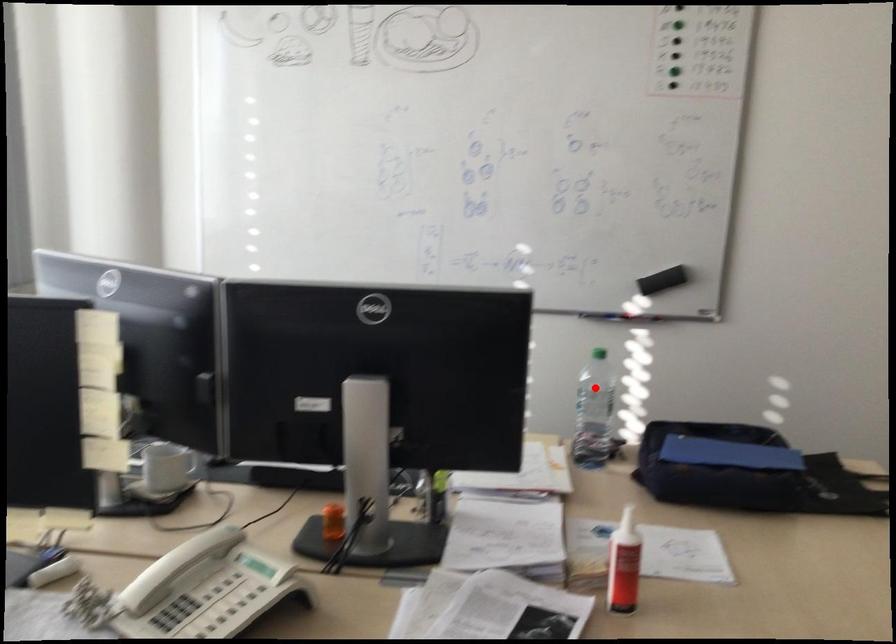
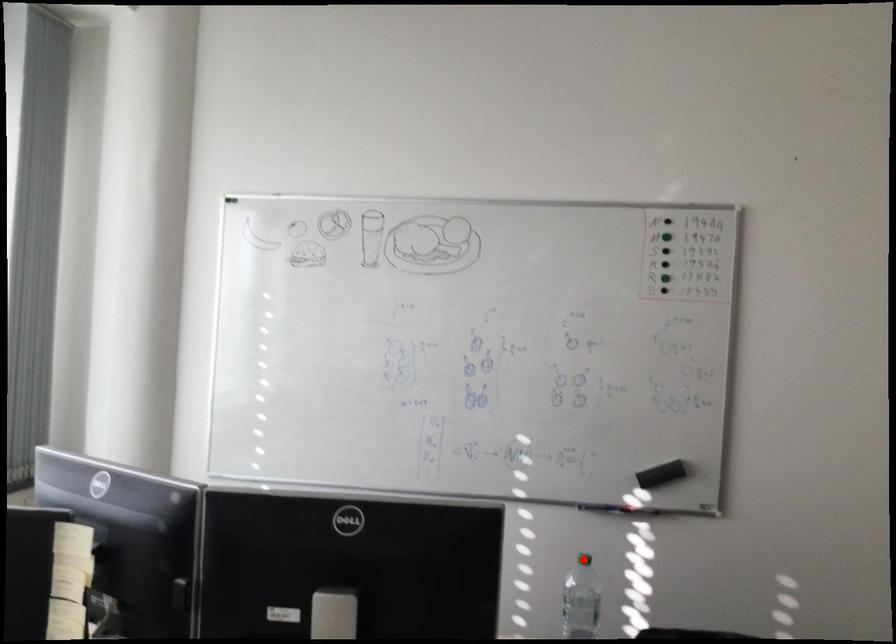
I am providing you with two images of the same scene from different viewpoints. A red point is marked on the first image and another point is marked on the second image. Is the red point in image1 aligned with the point shown in image2?

No